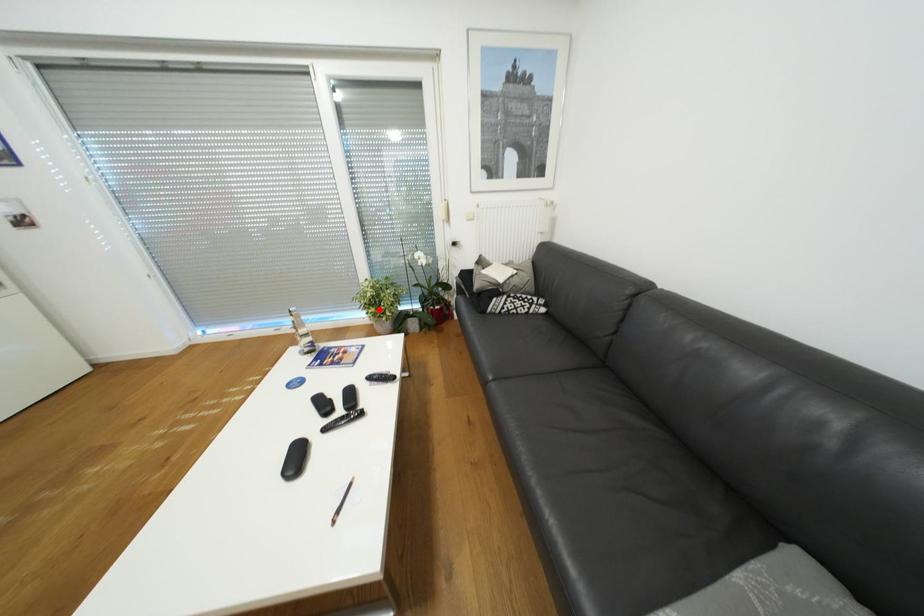
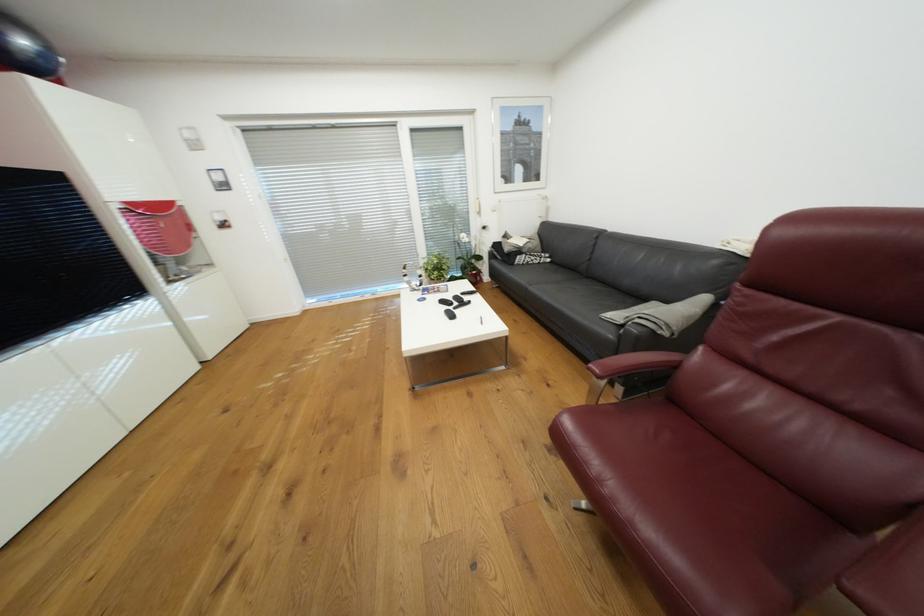
Locate, in the second image, the point that corresponds to the highlighted location in the first image.

(443, 273)